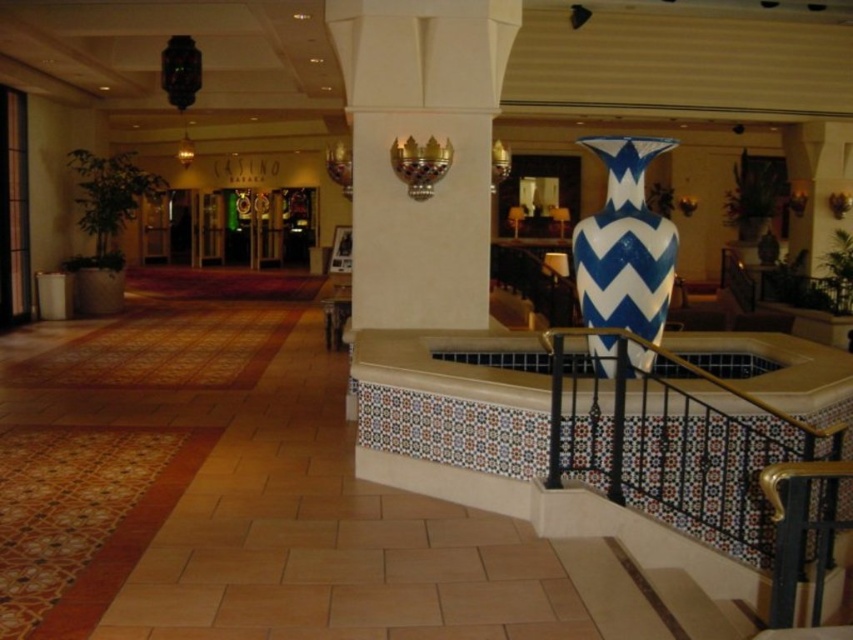
Which of these two, black metal railing at upper right or white glossy pillar at center, stands taller?

white glossy pillar at center

Which is behind, point (706, 508) or point (404, 132)?

Point (404, 132)

Is point (718, 506) less distant than point (471, 51)?

Yes, it is in front of point (471, 51).

Find the location of a particular element. black metal railing at upper right is located at coordinates (698, 454).

Does black metal railing at upper right have a greater height compared to blue and white ceramic vase at center-right?

No.

Is point (598, 483) positioned before point (659, 268)?

Yes.

Locate an element on the screen. The image size is (853, 640). black metal railing at upper right is located at coordinates (698, 454).

Is point (422, 310) farther from viewer compared to point (648, 312)?

That is True.

Is white glossy pillar at center above blue and white ceramic vase at center-right?

Yes, white glossy pillar at center is above blue and white ceramic vase at center-right.

I want to click on white glossy pillar at center, so click(x=421, y=144).